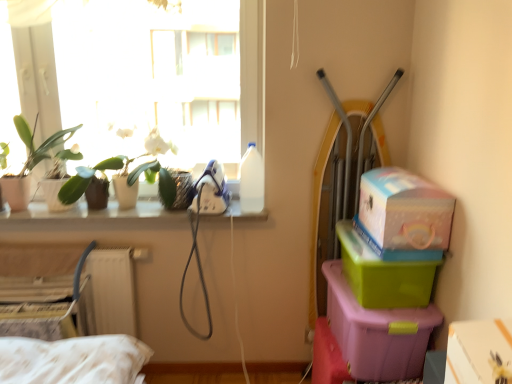
Question: Can you confirm if white glossy window sill at upper left is positioned to the right of white cardboard box at lower right, the 1th box in the right-to-left sequence?

Choices:
 (A) yes
 (B) no

Answer: (B)

Question: Does white glossy window sill at upper left have a larger size compared to white cardboard box at lower right, which ranks as the fifth box in left-to-right order?

Choices:
 (A) no
 (B) yes

Answer: (B)

Question: From a real-world perspective, does white glossy window sill at upper left stand above white cardboard box at lower right, which ranks as the fifth box in left-to-right order?

Choices:
 (A) no
 (B) yes

Answer: (B)

Question: Considering the relative sizes of white glossy window sill at upper left and white cardboard box at lower right, which ranks as the fifth box in left-to-right order, in the image provided, is white glossy window sill at upper left thinner than white cardboard box at lower right, which ranks as the fifth box in left-to-right order,?

Choices:
 (A) no
 (B) yes

Answer: (A)

Question: Is white glossy window sill at upper left oriented towards white cardboard box at lower right, the 1th box in the right-to-left sequence?

Choices:
 (A) no
 (B) yes

Answer: (A)

Question: From a real-world perspective, is white glossy window sill at upper left below white cardboard box at lower right, the 1th box in the right-to-left sequence?

Choices:
 (A) yes
 (B) no

Answer: (B)

Question: Can green matte plant at upper left, acting as the first plant starting from the left, be found inside pastel cardboard box at upper right, marked as the 3th box in a left-to-right arrangement?

Choices:
 (A) no
 (B) yes

Answer: (A)

Question: Is pastel cardboard box at upper right, arranged as the 3th box when viewed from the right, wider than green matte plant at upper left, positioned as the second plant in right-to-left order?

Choices:
 (A) no
 (B) yes

Answer: (B)

Question: From a real-world perspective, is pastel cardboard box at upper right, arranged as the 3th box when viewed from the right, on top of green matte plant at upper left, acting as the first plant starting from the left?

Choices:
 (A) yes
 (B) no

Answer: (B)

Question: Can we say pastel cardboard box at upper right, marked as the 3th box in a left-to-right arrangement, lies outside green matte plant at upper left, positioned as the second plant in right-to-left order?

Choices:
 (A) yes
 (B) no

Answer: (A)

Question: Is pastel cardboard box at upper right, arranged as the 3th box when viewed from the right, next to green matte plant at upper left, positioned as the second plant in right-to-left order, and touching it?

Choices:
 (A) yes
 (B) no

Answer: (B)

Question: Considering the relative positions of pastel cardboard box at upper right, marked as the 3th box in a left-to-right arrangement, and green matte plant at upper left, acting as the first plant starting from the left, in the image provided, is pastel cardboard box at upper right, marked as the 3th box in a left-to-right arrangement, to the right of green matte plant at upper left, acting as the first plant starting from the left, from the viewer's perspective?

Choices:
 (A) no
 (B) yes

Answer: (B)

Question: Can green plastic box at right, the second box viewed from the right, be found inside white cardboard box at lower right, which ranks as the fifth box in left-to-right order?

Choices:
 (A) no
 (B) yes

Answer: (A)